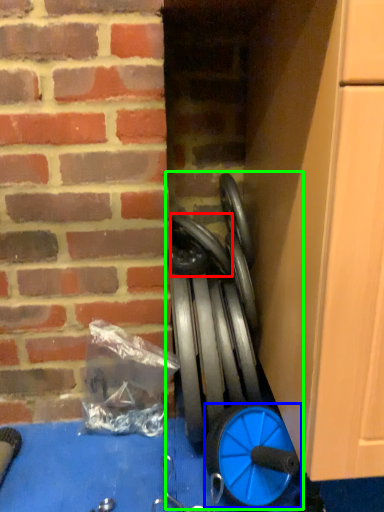
Question: Which is farther away from car tire (highlighted by a red box)? wheel (highlighted by a blue box) or sport equipment (highlighted by a green box)?

Choices:
 (A) wheel
 (B) sport equipment

Answer: (A)